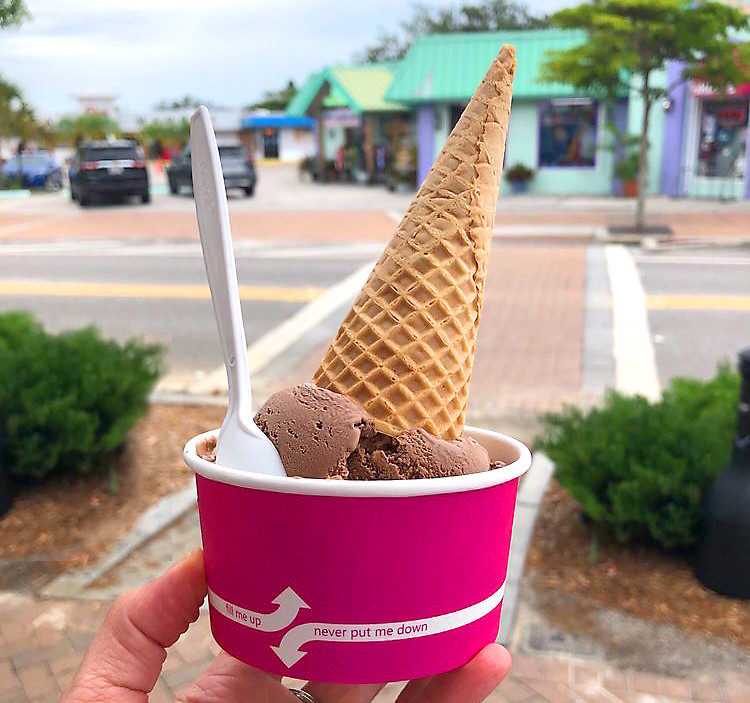
I want to click on bowl, so click(x=352, y=555).